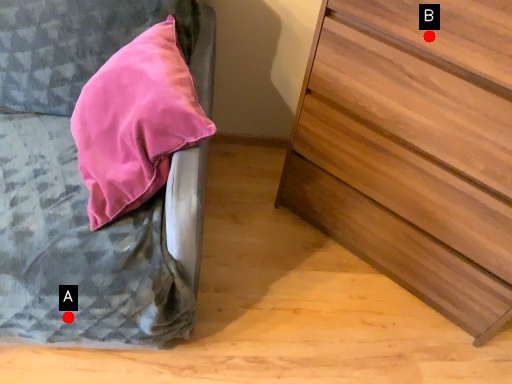
Question: Two points are circled on the image, labeled by A and B beside each circle. Which point is farther to the camera?

Choices:
 (A) A is further
 (B) B is further

Answer: (A)